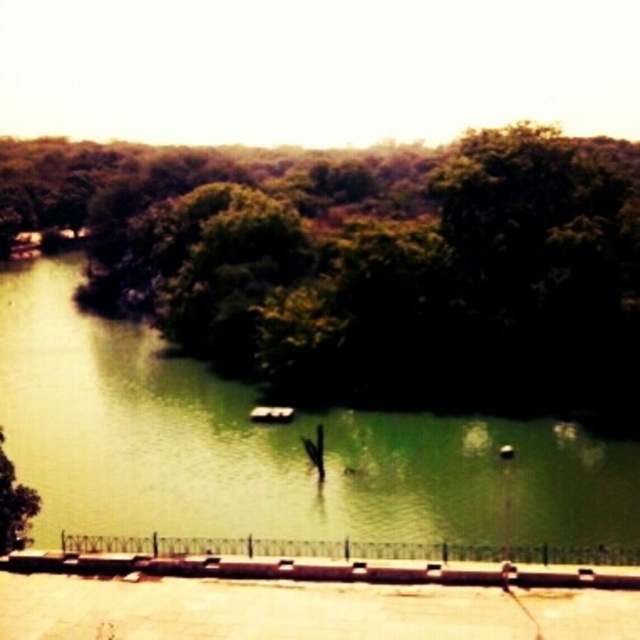
Question: Does green leafy tree at center have a smaller size compared to green water at center?

Choices:
 (A) yes
 (B) no

Answer: (B)

Question: Which of the following is the closest to the observer?

Choices:
 (A) green leafy tree at center
 (B) green water at center

Answer: (B)

Question: Among these points, which one is nearest to the camera?

Choices:
 (A) (554, 468)
 (B) (468, 232)

Answer: (A)

Question: From the image, what is the correct spatial relationship of green leafy tree at center in relation to green water at center?

Choices:
 (A) right
 (B) left

Answer: (A)

Question: Which of the following is the closest to the observer?

Choices:
 (A) green leafy tree at center
 (B) green water at center

Answer: (B)

Question: Can you confirm if green leafy tree at center is smaller than green water at center?

Choices:
 (A) no
 (B) yes

Answer: (A)